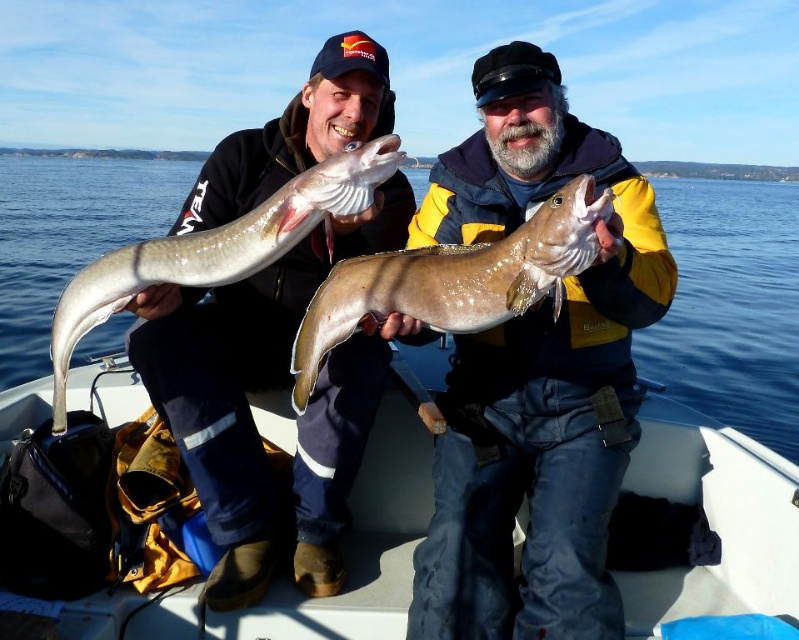
You are planning to row across the lake in the white plastic boat at center. The lake is filled with the translucent water at center. Considering the boat and water, which one has a wider width?

The white plastic boat at center has a lesser width compared to the translucent water at center, so the water is wider.

You are a photographer trying to capture the smooth brown fish at center and the translucent water at center in a single shot. Since you want both subjects to be in focus, which one should you focus on to ensure the other is also sharp?

You should focus on the smooth brown fish at center because it is closer to the camera than the translucent water at center, which is much taller. By focusing on the closer subject, the depth of field will include the farther one.

Based on the scene description, can you determine the position of the white plastic boat at center relative to the translucent water at center?

The white plastic boat at center is to the right of the translucent water at center.